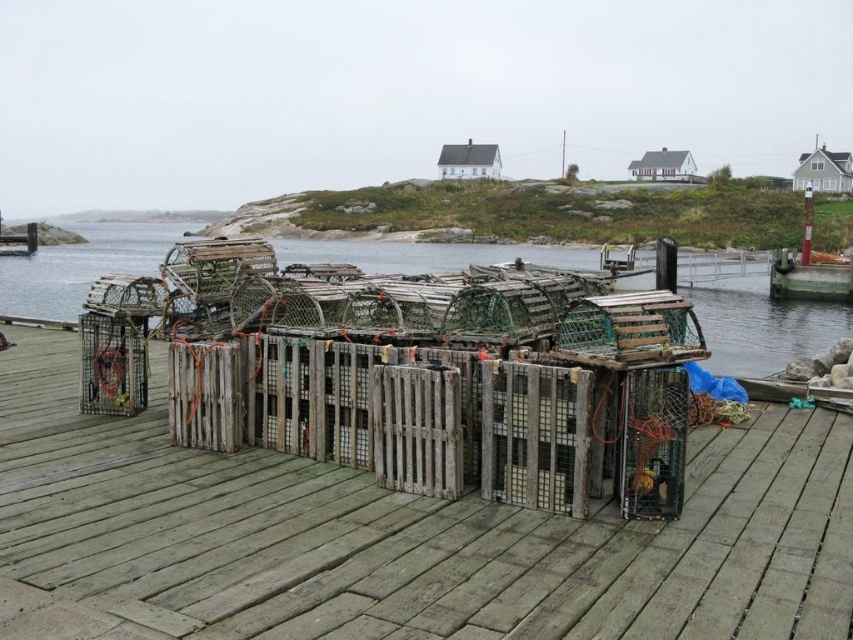
Question: Among these objects, which one is nearest to the camera?

Choices:
 (A) wooden dock at lower right
 (B) weathered wood crates at center

Answer: (B)

Question: Does weathered wood crates at center have a smaller size compared to wooden crates at center?

Choices:
 (A) yes
 (B) no

Answer: (A)

Question: Which is farther from the wooden crates at center?

Choices:
 (A) weathered wood crates at center
 (B) wooden dock at lower right

Answer: (B)

Question: Is wooden crates at center below wooden dock at lower right?

Choices:
 (A) yes
 (B) no

Answer: (B)

Question: Considering the relative positions of weathered wood crates at center and wooden dock at lower right in the image provided, where is weathered wood crates at center located with respect to wooden dock at lower right?

Choices:
 (A) left
 (B) right

Answer: (A)

Question: Which of the following is the closest to the observer?

Choices:
 (A) wooden dock at lower right
 (B) wooden crates at center
 (C) weathered wood crates at center

Answer: (C)